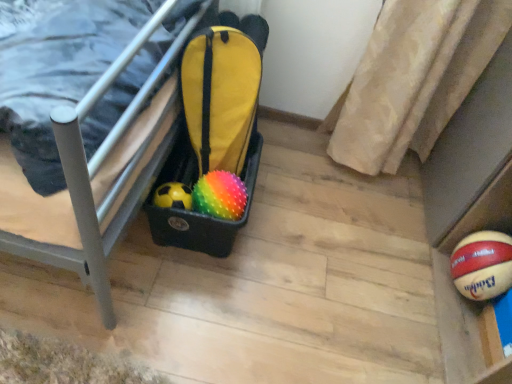
Question: Considering the relative positions of spongy multicolored ball at center and black plastic storage bin at lower left in the image provided, is spongy multicolored ball at center behind black plastic storage bin at lower left?

Choices:
 (A) no
 (B) yes

Answer: (B)

Question: Is spongy multicolored ball at center taller than black plastic storage bin at lower left?

Choices:
 (A) yes
 (B) no

Answer: (B)

Question: From a real-world perspective, is spongy multicolored ball at center beneath black plastic storage bin at lower left?

Choices:
 (A) no
 (B) yes

Answer: (B)

Question: Is black plastic storage bin at lower left located within spongy multicolored ball at center?

Choices:
 (A) no
 (B) yes

Answer: (A)

Question: Is spongy multicolored ball at center not inside black plastic storage bin at lower left?

Choices:
 (A) yes
 (B) no

Answer: (A)

Question: Considering the relative sizes of spongy multicolored ball at center and black plastic storage bin at lower left in the image provided, is spongy multicolored ball at center bigger than black plastic storage bin at lower left?

Choices:
 (A) no
 (B) yes

Answer: (A)

Question: Can spongy multicolored ball at center be found inside black plastic storage bin at lower left?

Choices:
 (A) yes
 (B) no

Answer: (B)

Question: Would you say black plastic storage bin at lower left is outside spongy multicolored ball at center?

Choices:
 (A) yes
 (B) no

Answer: (A)

Question: Is black plastic storage bin at lower left thinner than spongy multicolored ball at center?

Choices:
 (A) no
 (B) yes

Answer: (A)

Question: Can you confirm if black plastic storage bin at lower left is smaller than spongy multicolored ball at center?

Choices:
 (A) no
 (B) yes

Answer: (A)

Question: Is black plastic storage bin at lower left at the left side of spongy multicolored ball at center?

Choices:
 (A) no
 (B) yes

Answer: (B)

Question: Considering the relative sizes of black plastic storage bin at lower left and spongy multicolored ball at center in the image provided, is black plastic storage bin at lower left shorter than spongy multicolored ball at center?

Choices:
 (A) yes
 (B) no

Answer: (B)

Question: From the image's perspective, is black plastic storage bin at lower left above or below spongy multicolored ball at center?

Choices:
 (A) above
 (B) below

Answer: (A)